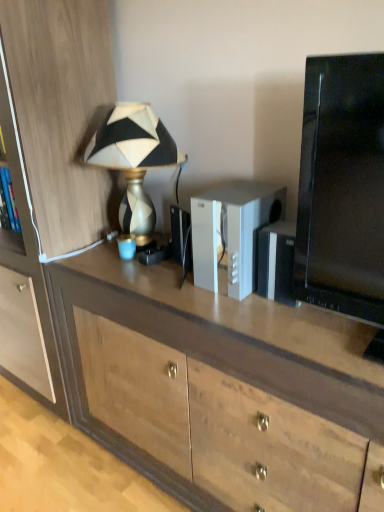
Question: Considering the positions of white plastic speaker at center and wooden desk at center in the image, is white plastic speaker at center taller or shorter than wooden desk at center?

Choices:
 (A) tall
 (B) short

Answer: (B)

Question: Is white plastic speaker at center to the left or to the right of wooden desk at center in the image?

Choices:
 (A) left
 (B) right

Answer: (B)

Question: Estimate the real-world distances between objects in this image. Which object is closer to the metallic gold lamp at upper left?

Choices:
 (A) wooden desk at center
 (B) wooden cabinet at left
 (C) white plastic speaker at center

Answer: (B)

Question: Which is nearer to the white plastic speaker at center?

Choices:
 (A) metallic gold lamp at upper left
 (B) wooden cabinet at left
 (C) wooden desk at center

Answer: (C)